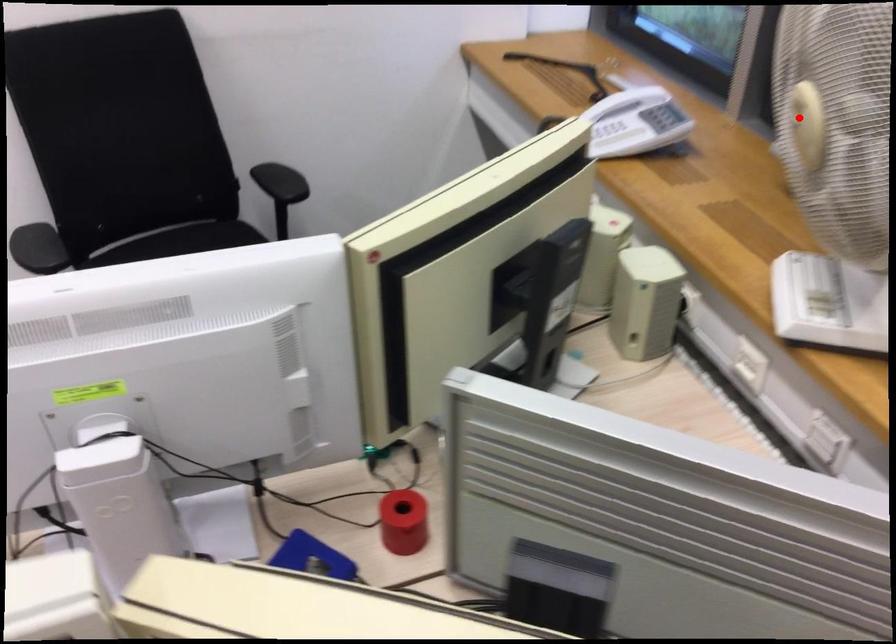
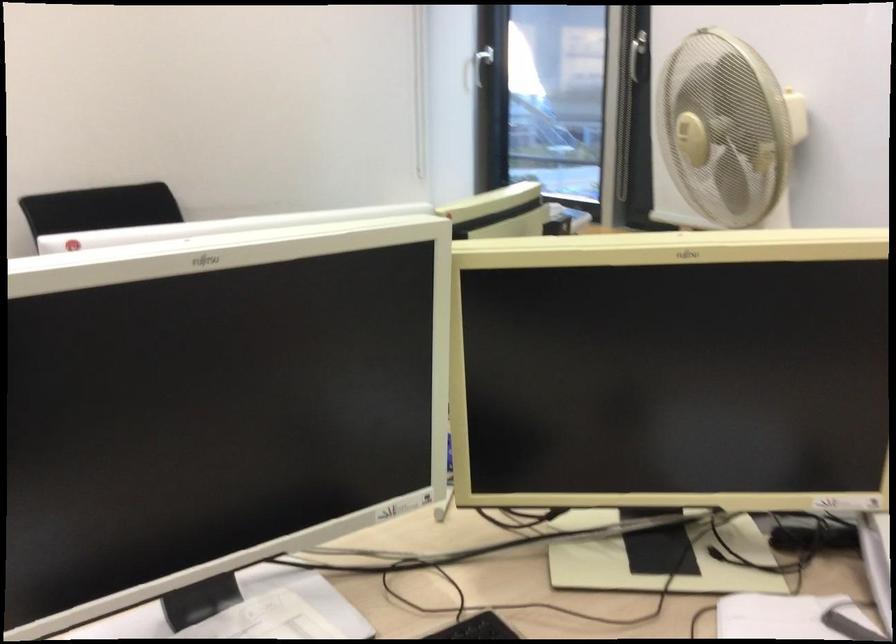
Question: I am providing you with two images of the same scene from different viewpoints. Image1 has a red point marked. In image2, the corresponding 3D location appears at what relative position? Reply with the corresponding letter.

Choices:
 (A) Closer
 (B) Farther

Answer: (B)